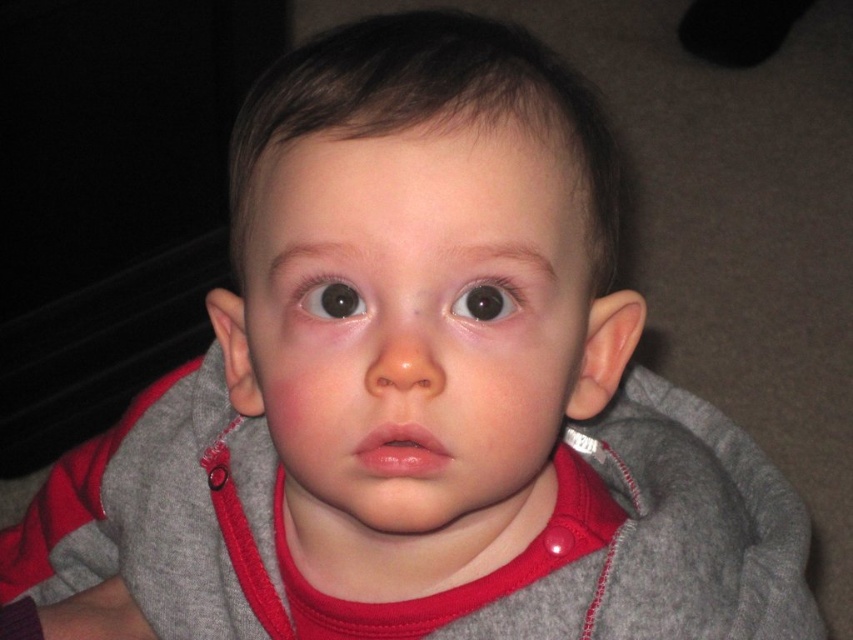
Question: Can you confirm if smooth skin face at center is bigger than black glossy eye at center?

Choices:
 (A) yes
 (B) no

Answer: (A)

Question: Can you confirm if smooth skin face at center is positioned below black glossy eye at center?

Choices:
 (A) no
 (B) yes

Answer: (B)

Question: Does black glossy eye at center appear on the left side of brown glossy eye at center?

Choices:
 (A) yes
 (B) no

Answer: (B)

Question: Which point is farther to the camera?

Choices:
 (A) smooth skin face at center
 (B) brown glossy eye at center

Answer: (B)

Question: Considering the real-world distances, which object is closest to the brown glossy eye at center?

Choices:
 (A) black glossy eye at center
 (B) smooth skin face at center

Answer: (A)

Question: Which object appears closest to the camera in this image?

Choices:
 (A) brown glossy eye at center
 (B) smooth skin face at center
 (C) black glossy eye at center

Answer: (B)